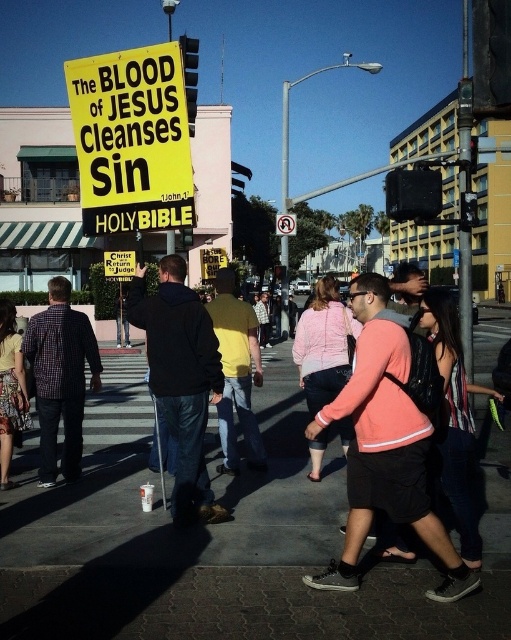
Question: Is gray concrete sidewalk at center smaller than yellow paper sign at upper left?

Choices:
 (A) yes
 (B) no

Answer: (A)

Question: Which point is farther to the camera?

Choices:
 (A) (114, 150)
 (B) (281, 632)

Answer: (A)

Question: Which point appears farthest from the camera in this image?

Choices:
 (A) (155, 81)
 (B) (487, 618)

Answer: (A)

Question: Does gray concrete sidewalk at center have a larger size compared to yellow paper sign at upper left?

Choices:
 (A) yes
 (B) no

Answer: (B)

Question: Does gray concrete sidewalk at center have a smaller size compared to yellow paper sign at upper left?

Choices:
 (A) no
 (B) yes

Answer: (B)

Question: Which of the following is the farthest from the observer?

Choices:
 (A) yellow paper sign at upper left
 (B) gray concrete sidewalk at center

Answer: (A)